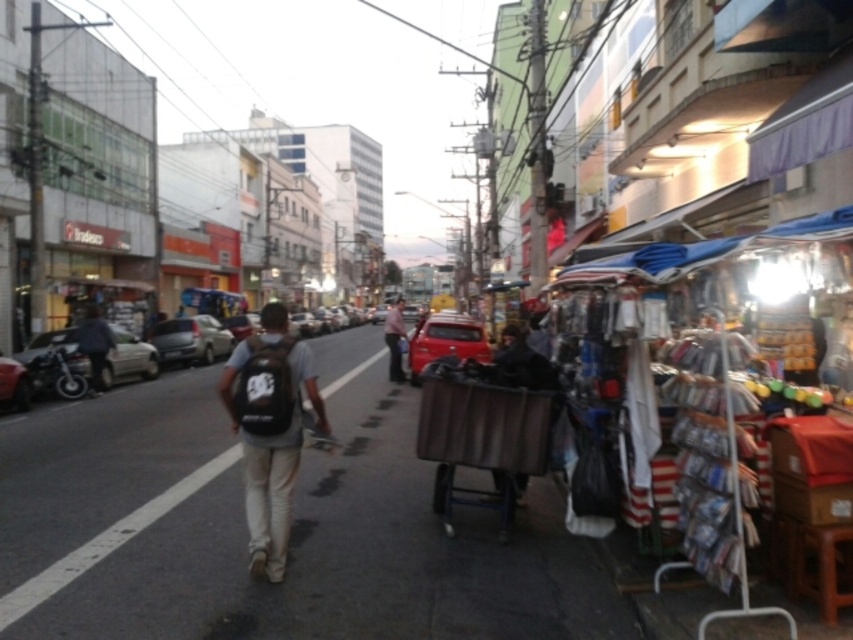
You are a pedestrian standing at the edge of the street. You see a light brown leather jacket at center and a brown fabric cart at right. Which object is closer to your right side?

The brown fabric cart at right is to the right of the light brown leather jacket at center, so the brown fabric cart at right is closer to your right side.

You are a delivery person trying to navigate through the street. There is a brown fabric cart at right and a light brown leather jacket at center in your path. Which object is closer to you?

The brown fabric cart at right is closer to you because it is in front of the light brown leather jacket at center.

You are a delivery person needing to place a large package on either the brown fabric cart at right or the light brown leather jacket at center. Based on their heights, which object can support the package without it toppling over?

The brown fabric cart at right has a lesser height compared to the light brown leather jacket at center, so the light brown leather jacket at center is taller and more stable for placing the large package without it toppling over.